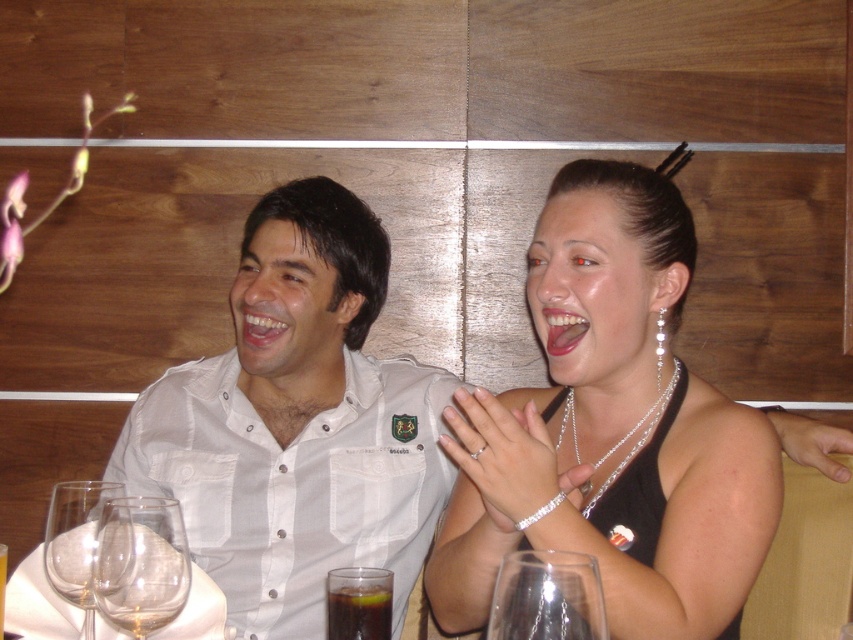
Does satin black dress at center have a lesser width compared to clear glass wine glass at lower left?

No.

The width and height of the screenshot is (853, 640). I want to click on satin black dress at center, so click(x=611, y=429).

Where is `dark brown liquid at lower center`? dark brown liquid at lower center is located at coordinates 358,611.

The width and height of the screenshot is (853, 640). In order to click on dark brown liquid at lower center in this screenshot , I will do `click(358, 611)`.

Between satin black dress at center and dark brown liquid at lower center, which one appears on the right side from the viewer's perspective?

Positioned to the right is satin black dress at center.

Is satin black dress at center below dark brown liquid at lower center?

No, satin black dress at center is not below dark brown liquid at lower center.

Between point (672, 560) and point (338, 620), which one is positioned in front?

Point (338, 620)

What are the coordinates of `satin black dress at center` in the screenshot? It's located at [x=611, y=429].